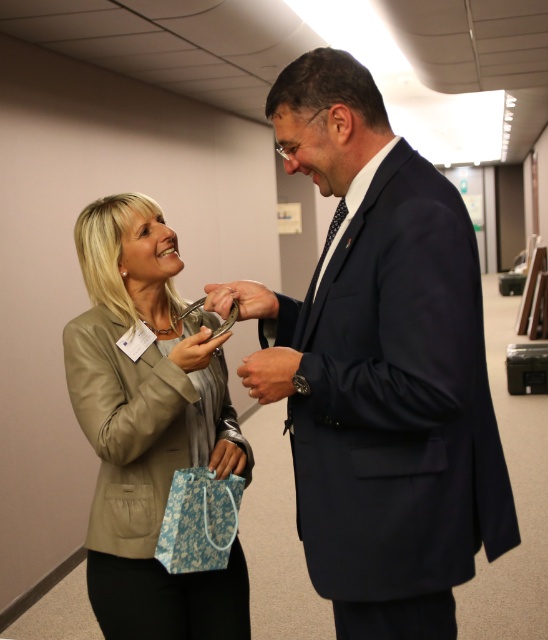
What are the coordinates of the navy blue suit at center?

The navy blue suit at center is located at coordinates point (x=379, y=368).

Based on the scene description, can you determine which clothing item is closer to the viewer between the navy blue suit at center and the beige leather jacket at left?

The navy blue suit at center is positioned over the beige leather jacket at left, so the navy blue suit at center is closer to the viewer.

You are a security guard checking the distance between the navy blue suit at center and the beige leather jacket at left. Which one is nearer to you?

The navy blue suit at center is closer to the viewer than the beige leather jacket at left, so the navy blue suit at center is nearer to you.